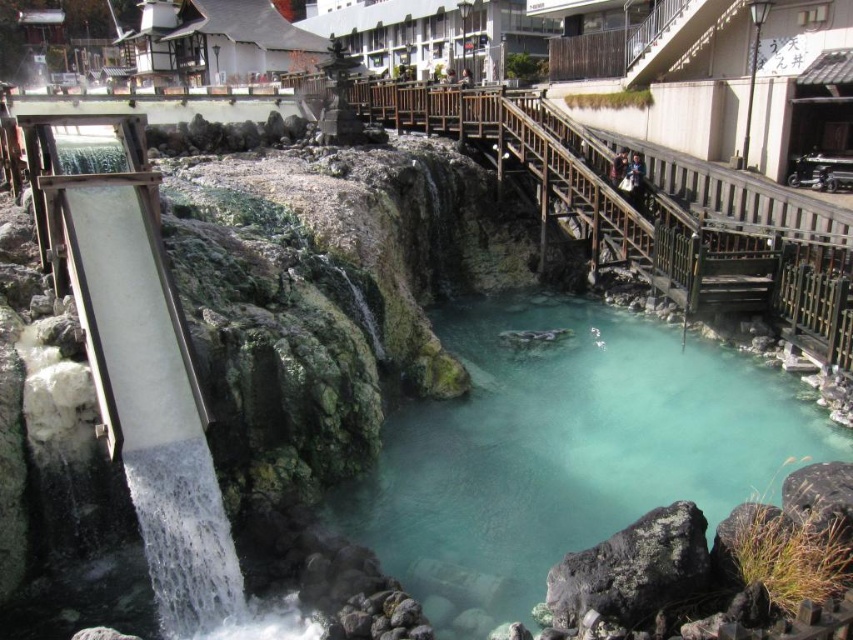
You are a tourist visiting the hot spring and want to take a photo of the white concrete waterfall at left and the turquoise stone water at center. Since you can only focus on one object clearly, which one should you focus on to ensure the other appears in the background?

You should focus on the white concrete waterfall at left because it is behind the turquoise stone water at center, so the waterfall will be in the background when focusing on the turquoise stone water at center. Wait, actually, the description says the waterfall is behind the water. Hmm, maybe I need to think again. If the waterfall is behind the water, then focusing on the water would have the waterfall in the background. But the question asks to focus on one so the other is in the background. Since the w.

You are planning to build a wooden walkway that is 1.2 meters wide. You need to decide whether to place it along the turquoise stone water at center or next to the white concrete waterfall at left. Based on their widths, which location would allow the walkway to fit without overlapping?

The turquoise stone water at center has a larger width than the white concrete waterfall at left. Since the walkway is 1.2 meters wide, it would fit better along the turquoise stone water at center where there is more space.